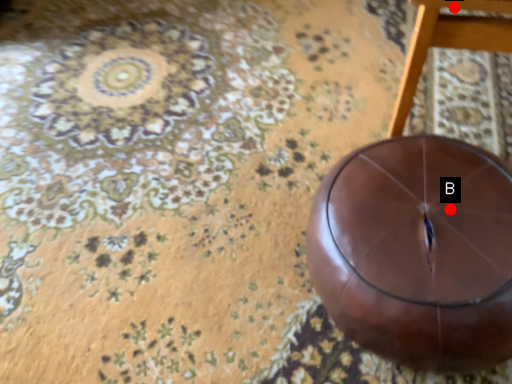
Question: Two points are circled on the image, labeled by A and B beside each circle. Which point is closer to the camera taking this photo?

Choices:
 (A) A is closer
 (B) B is closer

Answer: (A)